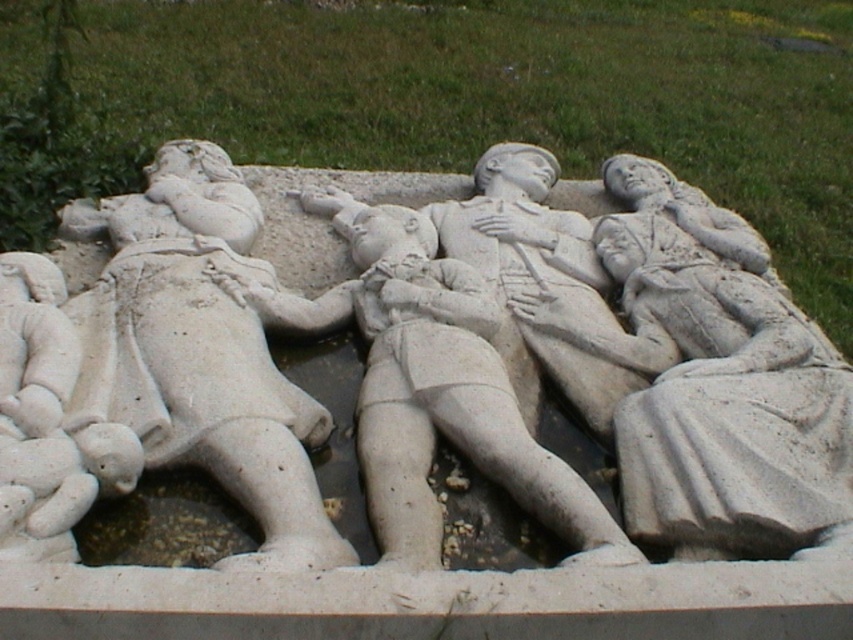
Question: Which object appears closest to the camera in this image?

Choices:
 (A) white stone figure at center
 (B) white stone sculpture at center

Answer: (B)

Question: Does white stone sculpture at center appear on the right side of white stone figure at center?

Choices:
 (A) yes
 (B) no

Answer: (A)

Question: Which object is farther from the camera taking this photo?

Choices:
 (A) white stone figure at center
 (B) white stone sculpture at center

Answer: (A)

Question: Among these points, which one is farthest from the camera?

Choices:
 (A) (39, 525)
 (B) (463, 269)
 (C) (694, 225)

Answer: (C)

Question: Is white stone sculpture at center bigger than white stone figure at center?

Choices:
 (A) no
 (B) yes

Answer: (B)

Question: Can you confirm if white stone sculpture at center is positioned below white stone figure at center?

Choices:
 (A) no
 (B) yes

Answer: (A)